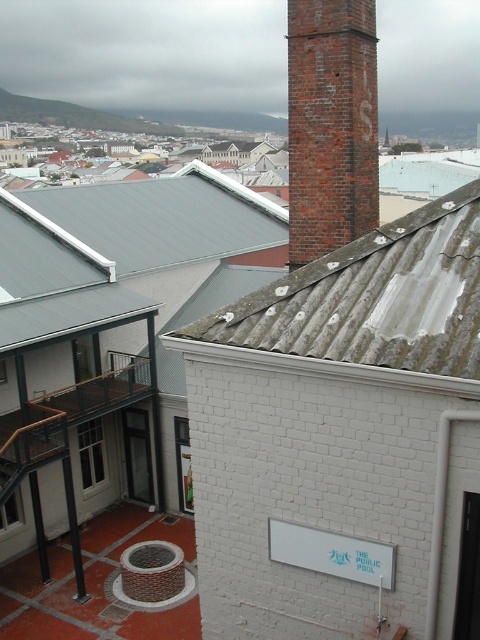
You are standing on the rooftop of the white brick building and want to locate the weathered metal roof at center. According to the coordinates provided, where should you look?

The weathered metal roof at center is located at point (372, 300).

You are a drone operator trying to navigate between the brick chimney at upper center and the metallic gray roof at upper left. Based on their heights, which one should you fly under to avoid collision?

The brick chimney at upper center has a lesser height compared to the metallic gray roof at upper left, so you should fly under the metallic gray roof at upper left to avoid collision.

You are a drone operator trying to land a drone on the rooftop of the white brick building. The drone has a landing pad that must align with the brick chimney at upper center. What are the coordinates where you should aim the drone?

The brick chimney at upper center is located at point (331, 124), so you should aim the drone at those coordinates to align with it.